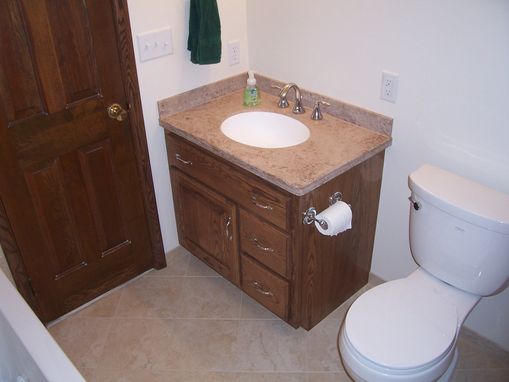
At what (x,y) coordinates should I click in order to perform the action: click on large square drawers. Please return your answer as a coordinate pair (x, y). This screenshot has width=509, height=382. Looking at the image, I should click on (270, 292), (271, 254).